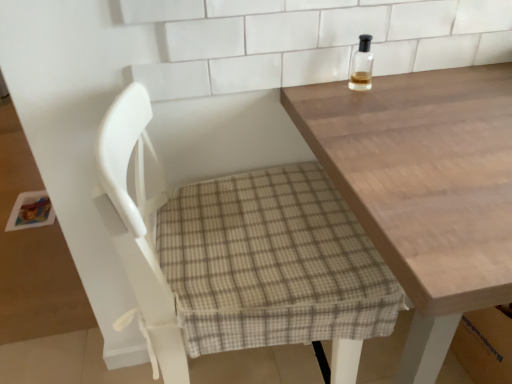
Question: Is white fabric chair at center to the left of light brown wooden table at upper right from the viewer's perspective?

Choices:
 (A) yes
 (B) no

Answer: (A)

Question: From the image's perspective, is white fabric chair at center above light brown wooden table at upper right?

Choices:
 (A) yes
 (B) no

Answer: (B)

Question: Is white fabric chair at center in front of light brown wooden table at upper right?

Choices:
 (A) yes
 (B) no

Answer: (B)

Question: Is white fabric chair at center to the right of light brown wooden table at upper right from the viewer's perspective?

Choices:
 (A) no
 (B) yes

Answer: (A)

Question: From a real-world perspective, is white fabric chair at center physically below light brown wooden table at upper right?

Choices:
 (A) no
 (B) yes

Answer: (A)

Question: Is clear glass bottle at upper right situated inside light brown wooden table at upper right or outside?

Choices:
 (A) outside
 (B) inside

Answer: (A)

Question: From the image's perspective, is clear glass bottle at upper right above or below light brown wooden table at upper right?

Choices:
 (A) below
 (B) above

Answer: (B)

Question: From their relative heights in the image, would you say clear glass bottle at upper right is taller or shorter than light brown wooden table at upper right?

Choices:
 (A) tall
 (B) short

Answer: (B)

Question: From a real-world perspective, relative to light brown wooden table at upper right, is clear glass bottle at upper right vertically above or below?

Choices:
 (A) below
 (B) above

Answer: (B)

Question: From a real-world perspective, is clear glass bottle at upper right above or below white fabric chair at center?

Choices:
 (A) above
 (B) below

Answer: (A)

Question: In the image, is clear glass bottle at upper right on the left side or the right side of white fabric chair at center?

Choices:
 (A) left
 (B) right

Answer: (B)

Question: Would you say clear glass bottle at upper right is inside or outside white fabric chair at center?

Choices:
 (A) outside
 (B) inside

Answer: (A)

Question: Is clear glass bottle at upper right taller or shorter than white fabric chair at center?

Choices:
 (A) short
 (B) tall

Answer: (A)

Question: Which is correct: light brown wooden table at upper right is inside white fabric chair at center, or outside of it?

Choices:
 (A) inside
 (B) outside

Answer: (B)

Question: Is light brown wooden table at upper right bigger or smaller than white fabric chair at center?

Choices:
 (A) small
 (B) big

Answer: (B)